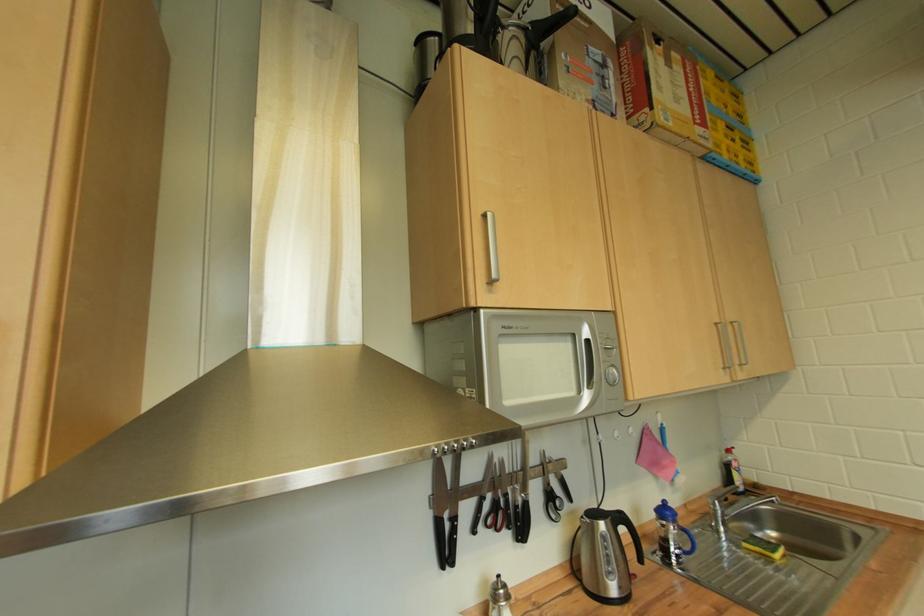
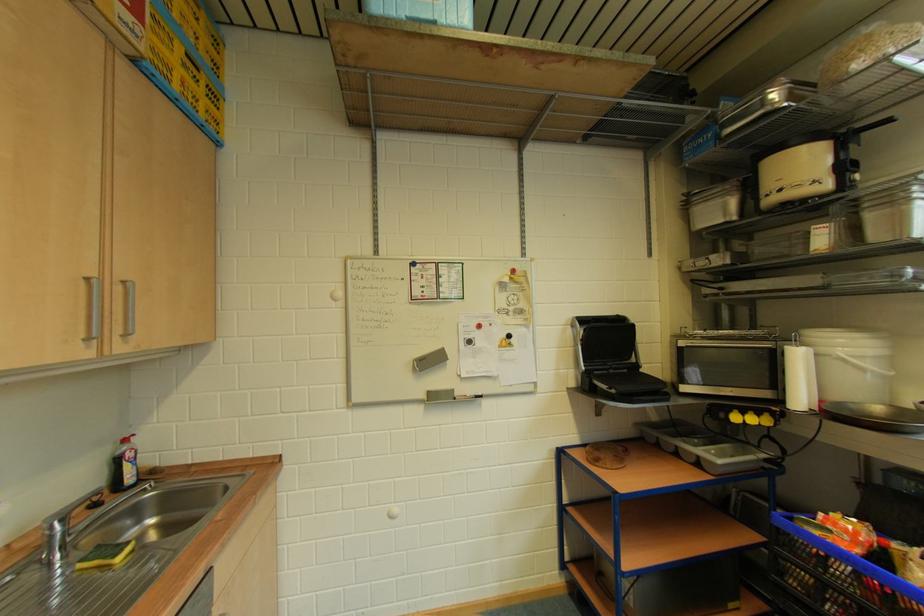
Locate, in the second image, the point that corresponds to the point at 739,472 in the first image.

(132, 464)